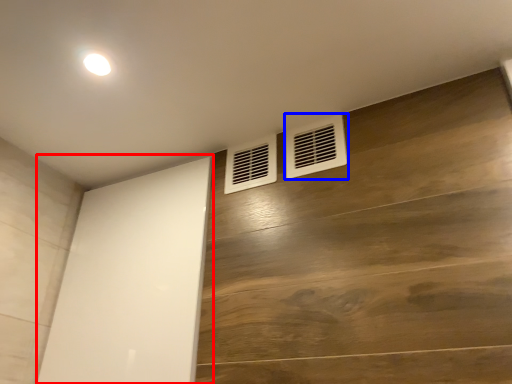
Question: Which of the following is the closest to the observer, screen door (highlighted by a red box) or air conditioning (highlighted by a blue box)?

Choices:
 (A) screen door
 (B) air conditioning

Answer: (A)